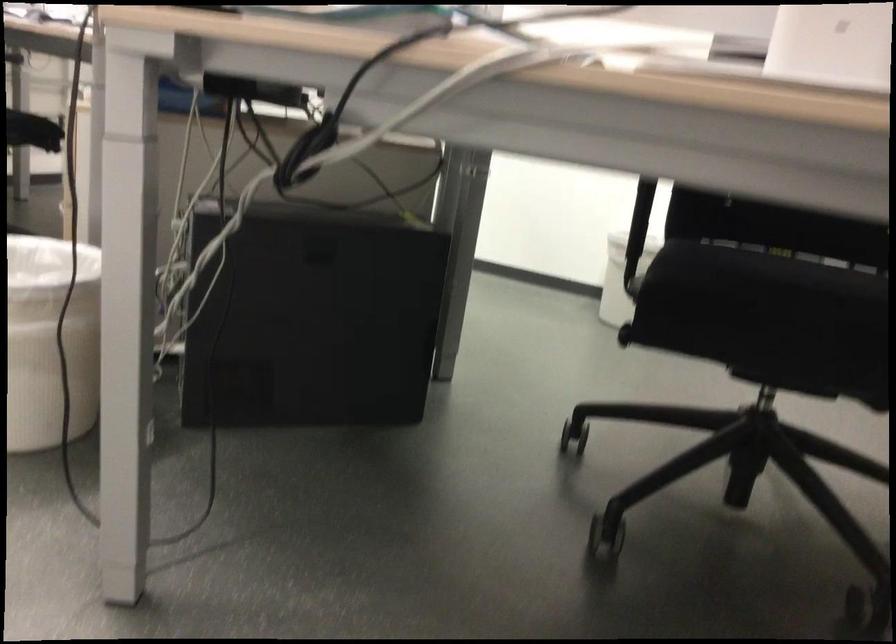
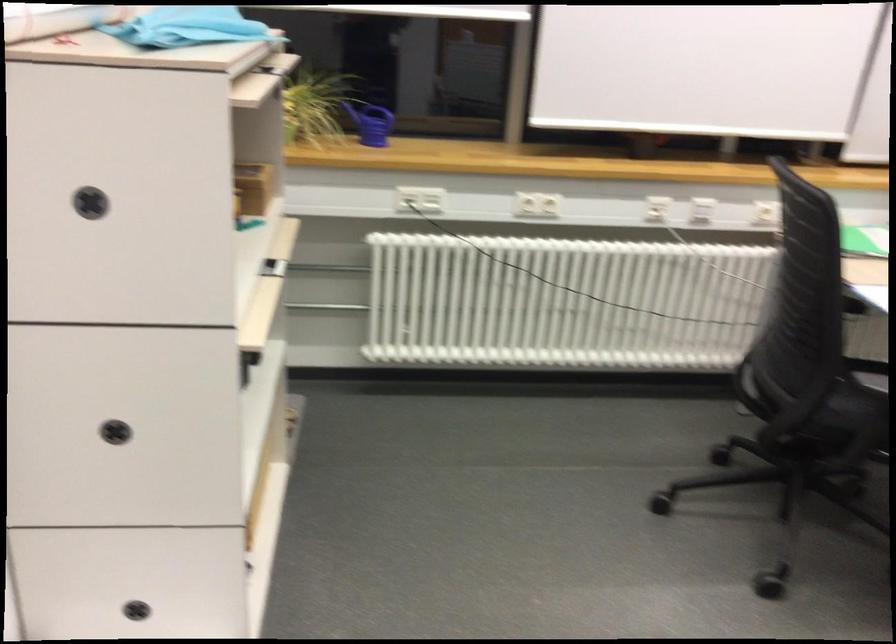
Question: Based on the continuous images, in which direction is the camera rotating? Reply with the corresponding letter.

Choices:
 (A) Left
 (B) Right
 (C) Up
 (D) Down

Answer: (A)